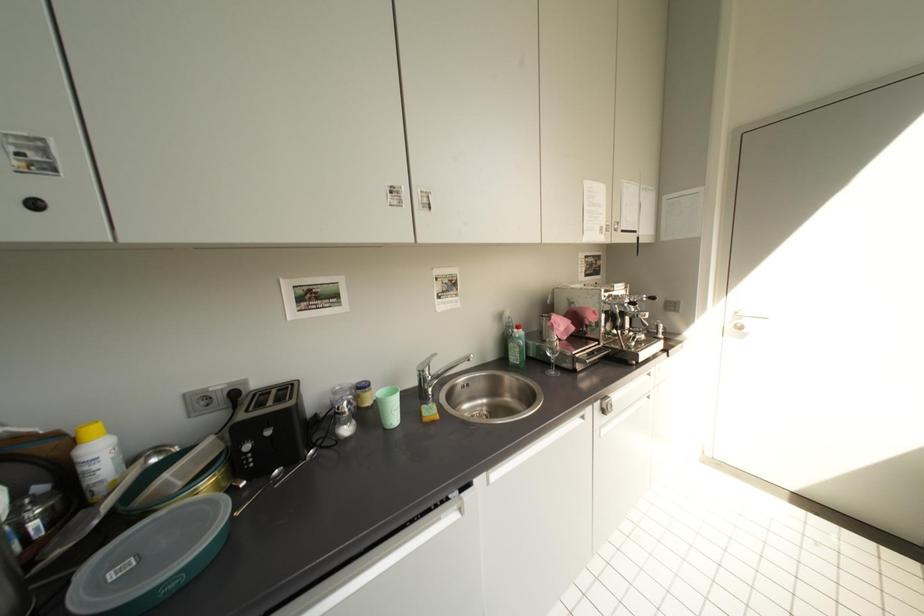
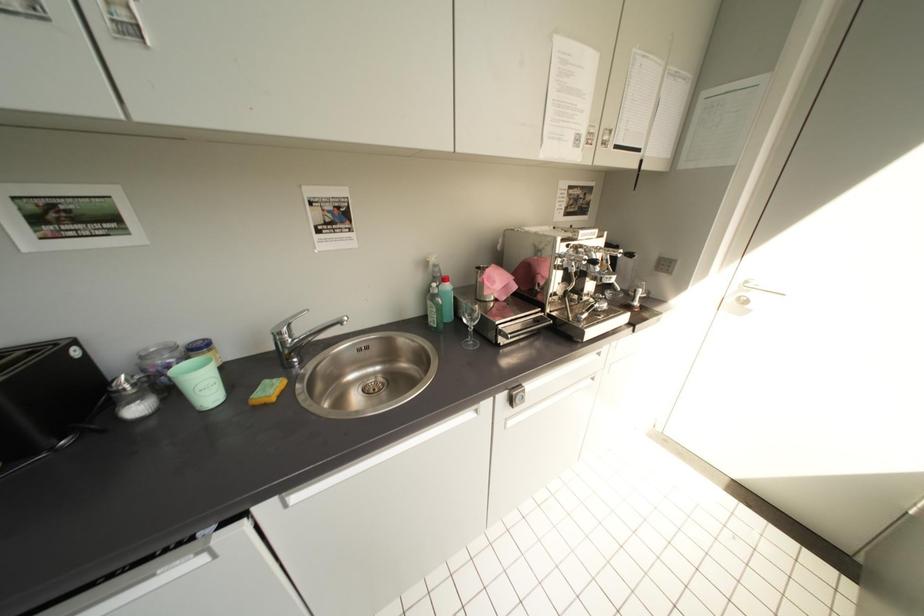
What movement of the cameraman would produce the second image?

The movement direction of the cameraman is right, forward.